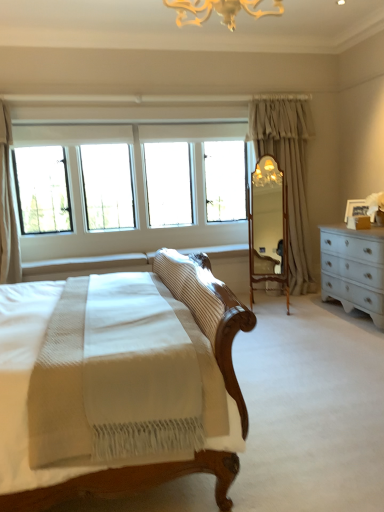
Question: Is white textured curtain at upper left, the first curtain from the front, at the back of wooden mirror at center?

Choices:
 (A) no
 (B) yes

Answer: (A)

Question: Is wooden mirror at center taller than white textured curtain at upper left, the second curtain viewed from the back?

Choices:
 (A) no
 (B) yes

Answer: (A)

Question: From the image's perspective, is wooden mirror at center located above white textured curtain at upper left, the second curtain viewed from the back?

Choices:
 (A) yes
 (B) no

Answer: (B)

Question: Is wooden mirror at center behind white textured curtain at upper left, the first curtain viewed from the left?

Choices:
 (A) yes
 (B) no

Answer: (A)

Question: Can you see wooden mirror at center touching white textured curtain at upper left, the first curtain viewed from the left?

Choices:
 (A) yes
 (B) no

Answer: (B)

Question: Looking at the image, does clear glass windows at upper left seem bigger or smaller compared to white textured curtain at upper left, the first curtain viewed from the left?

Choices:
 (A) small
 (B) big

Answer: (B)

Question: Is point (195, 177) positioned closer to the camera than point (6, 180)?

Choices:
 (A) closer
 (B) farther

Answer: (B)

Question: From the image's perspective, is clear glass windows at upper left positioned above or below white textured curtain at upper left, the second curtain viewed from the back?

Choices:
 (A) below
 (B) above

Answer: (B)

Question: From a real-world perspective, is clear glass windows at upper left positioned above or below white textured curtain at upper left, the first curtain viewed from the left?

Choices:
 (A) below
 (B) above

Answer: (B)

Question: Looking at their shapes, would you say light beige fabric curtain at center-right, placed as the second curtain when sorted from left to right, is wider or thinner than white textured curtain at upper left, the second curtain viewed from the back?

Choices:
 (A) thin
 (B) wide

Answer: (B)

Question: From their relative heights in the image, would you say light beige fabric curtain at center-right, the 1th curtain in the right-to-left sequence, is taller or shorter than white textured curtain at upper left, the first curtain viewed from the left?

Choices:
 (A) short
 (B) tall

Answer: (B)

Question: From a real-world perspective, is light beige fabric curtain at center-right, the 1th curtain positioned from the back, above or below white textured curtain at upper left, the first curtain from the front?

Choices:
 (A) above
 (B) below

Answer: (B)

Question: Is point (269, 129) closer or farther from the camera than point (11, 261)?

Choices:
 (A) farther
 (B) closer

Answer: (A)

Question: Is point (19, 266) positioned closer to the camera than point (274, 172)?

Choices:
 (A) closer
 (B) farther

Answer: (B)

Question: From a real-world perspective, relative to wooden mirror at center, is white textured curtain at upper left, which is the second curtain from right to left, vertically above or below?

Choices:
 (A) below
 (B) above

Answer: (B)